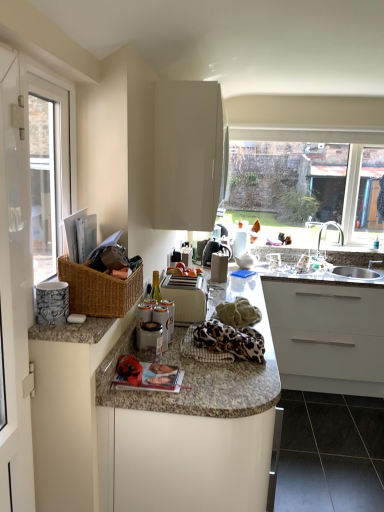
I want to click on free point above white glossy screen door at left (from a real-world perspective), so click(x=16, y=37).